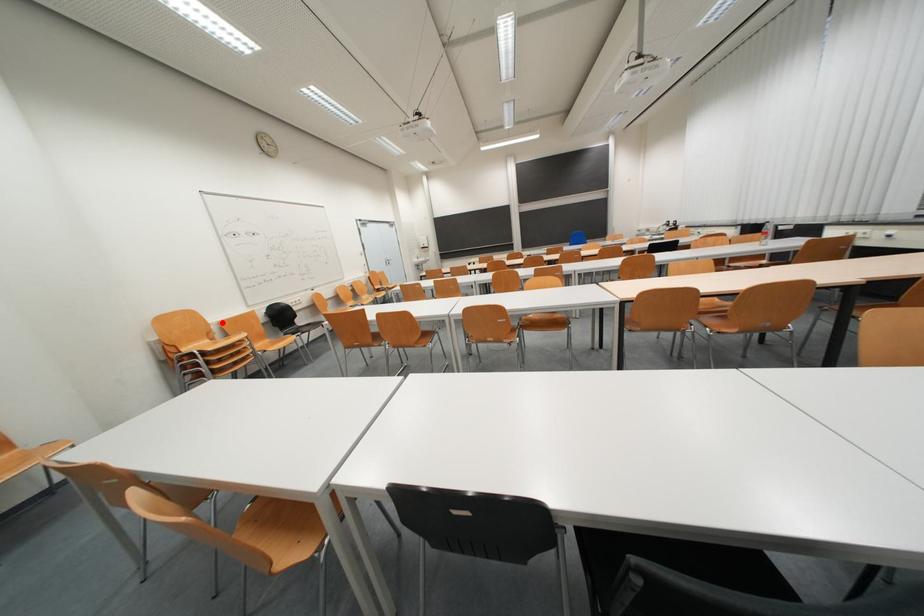
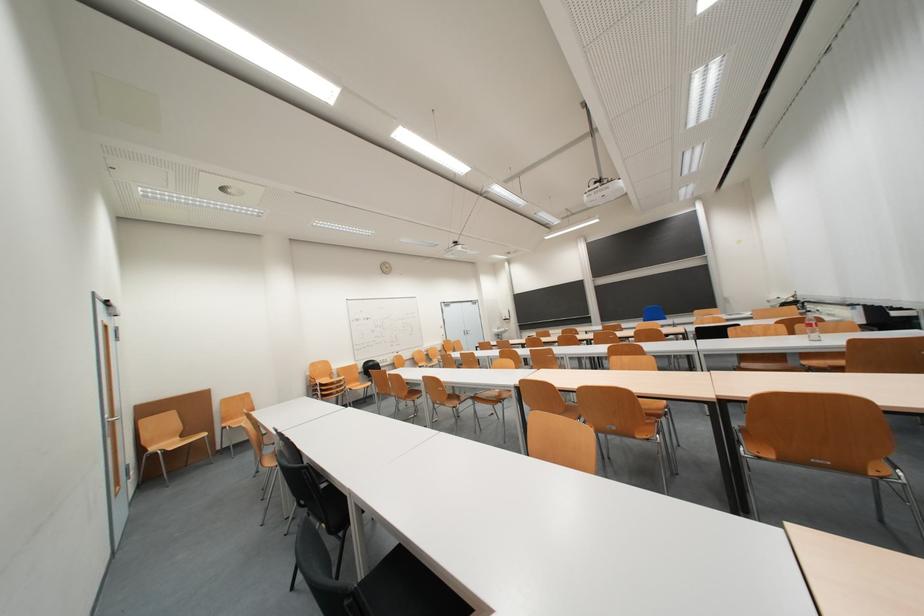
Find the pixel in the second image that matches the highlighted location in the first image.

(343, 371)